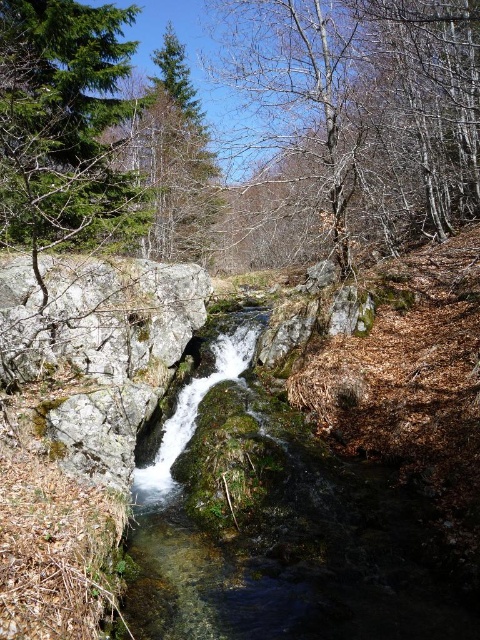
You are standing at the edge of the rocky slope in the scene. You want to place a small weatherproof sign exactly at the center of the clear water at center. According to the coordinates provided, what are the coordinates where you should place the sign?

The coordinates for placing the sign at the center of the clear water at center are exactly at point (x=280, y=538).